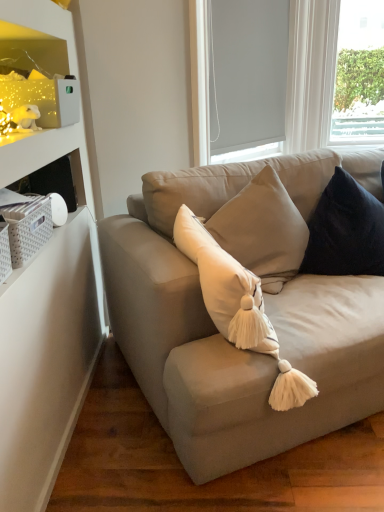
Question: Does velvet dark blue pillow at upper right have a greater height compared to matte white shelf at upper left?

Choices:
 (A) no
 (B) yes

Answer: (B)

Question: From a real-world perspective, is velvet dark blue pillow at upper right beneath matte white shelf at upper left?

Choices:
 (A) yes
 (B) no

Answer: (A)

Question: Is velvet dark blue pillow at upper right looking in the opposite direction of matte white shelf at upper left?

Choices:
 (A) no
 (B) yes

Answer: (A)

Question: Does velvet dark blue pillow at upper right appear on the left side of matte white shelf at upper left?

Choices:
 (A) yes
 (B) no

Answer: (B)

Question: From the image's perspective, is velvet dark blue pillow at upper right on top of matte white shelf at upper left?

Choices:
 (A) no
 (B) yes

Answer: (A)

Question: Is velvet dark blue pillow at upper right not within matte white shelf at upper left?

Choices:
 (A) no
 (B) yes

Answer: (B)

Question: Considering the relative sizes of white matte window screen at upper right and matte white shelf at upper left in the image provided, is white matte window screen at upper right smaller than matte white shelf at upper left?

Choices:
 (A) yes
 (B) no

Answer: (B)

Question: Can you confirm if white matte window screen at upper right is taller than matte white shelf at upper left?

Choices:
 (A) yes
 (B) no

Answer: (A)

Question: Can you confirm if white matte window screen at upper right is positioned to the right of matte white shelf at upper left?

Choices:
 (A) yes
 (B) no

Answer: (A)

Question: Is white matte window screen at upper right directly adjacent to matte white shelf at upper left?

Choices:
 (A) yes
 (B) no

Answer: (B)

Question: Is white matte window screen at upper right positioned in front of matte white shelf at upper left?

Choices:
 (A) yes
 (B) no

Answer: (B)

Question: Can you confirm if white matte window screen at upper right is thinner than matte white shelf at upper left?

Choices:
 (A) no
 (B) yes

Answer: (B)

Question: Is white matte window screen at upper right far away from white roller blind at upper center?

Choices:
 (A) yes
 (B) no

Answer: (B)